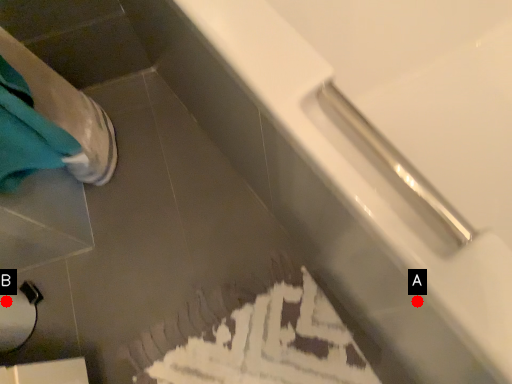
Question: Two points are circled on the image, labeled by A and B beside each circle. Among these points, which one is farthest from the camera?

Choices:
 (A) A is further
 (B) B is further

Answer: (B)